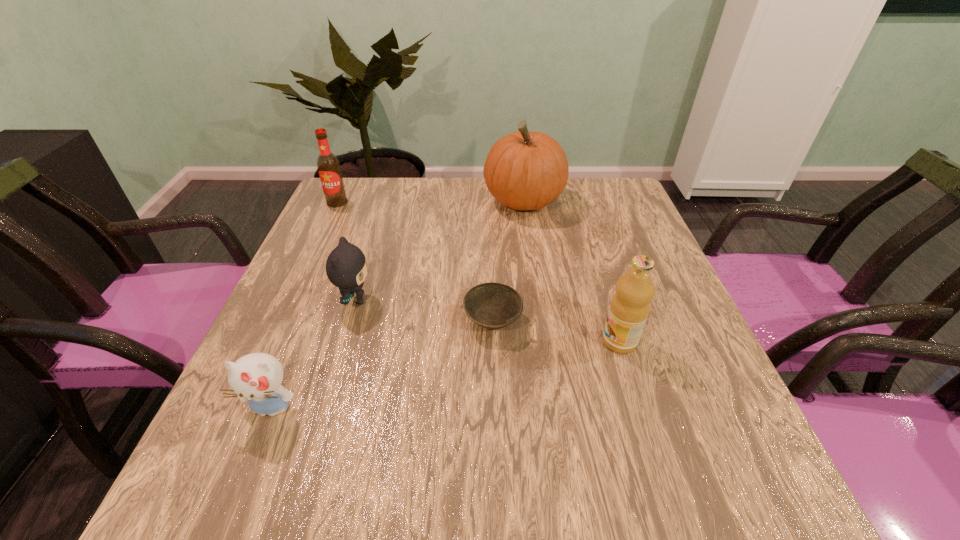
You are a GUI agent. You are given a task and a screenshot of the screen. Output one action in this format:
    pyautogui.click(x=<x>, y=<y>)
    Task: Click on the free location located 0.300m on the stem of the pumpkin
    The image size is (960, 540).
    Given the screenshot: What is the action you would take?
    pyautogui.click(x=379, y=201)

Identify the location of free location located on the right of the beer bottle. (469, 202).

Where is `vacant space situated 0.080m on the label of the olive oil`? The width and height of the screenshot is (960, 540). vacant space situated 0.080m on the label of the olive oil is located at coordinates (562, 341).

You are a GUI agent. You are given a task and a screenshot of the screen. Output one action in this format:
    pyautogui.click(x=<x>, y=<y>)
    Task: Click on the free spot located on the label of the olive oil
    Image resolution: width=960 pixels, height=540 pixels.
    Given the screenshot: What is the action you would take?
    pyautogui.click(x=446, y=341)

You are a GUI agent. You are given a task and a screenshot of the screen. Output one action in this format:
    pyautogui.click(x=<x>, y=<y>)
    Task: Click on the free space located 0.260m on the label of the olive oil
    
    Given the screenshot: What is the action you would take?
    pyautogui.click(x=471, y=341)

The image size is (960, 540). What are the coordinates of `free space located 0.220m on the front-facing side of the farther kitten` in the screenshot? It's located at (473, 300).

You are a GUI agent. You are given a task and a screenshot of the screen. Output one action in this format:
    pyautogui.click(x=<x>, y=<y>)
    Task: Click on the free space located on the front-facing side of the nearer kitten
    This screenshot has width=960, height=540.
    Given the screenshot: What is the action you would take?
    click(x=249, y=463)

The image size is (960, 540). What are the coordinates of `vacant region located on the left of the bowl` in the screenshot? It's located at (344, 321).

Find the location of `pumpkin located in the far edge section of the desktop`. pumpkin located in the far edge section of the desktop is located at coordinates (524, 170).

Locate an element on the screen. The height and width of the screenshot is (540, 960). beer bottle located in the far edge section of the desktop is located at coordinates [x=328, y=165].